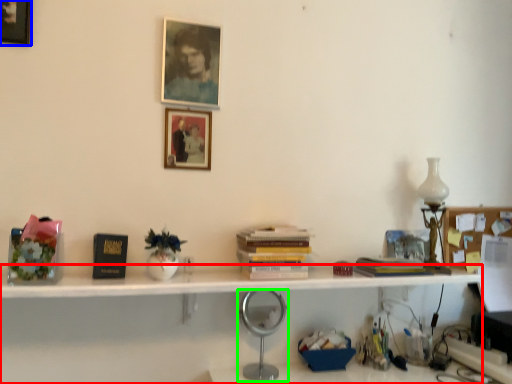
Question: Based on their relative distances, which object is farther from bookshelf (highlighted by a red box)? Choose from picture frame (highlighted by a blue box) and table lamp (highlighted by a green box).

Choices:
 (A) picture frame
 (B) table lamp

Answer: (A)